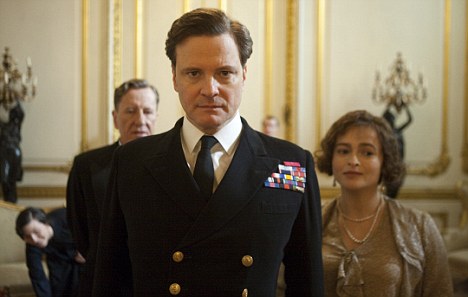
Where is `wall`? The image size is (468, 297). wall is located at coordinates (351, 45).